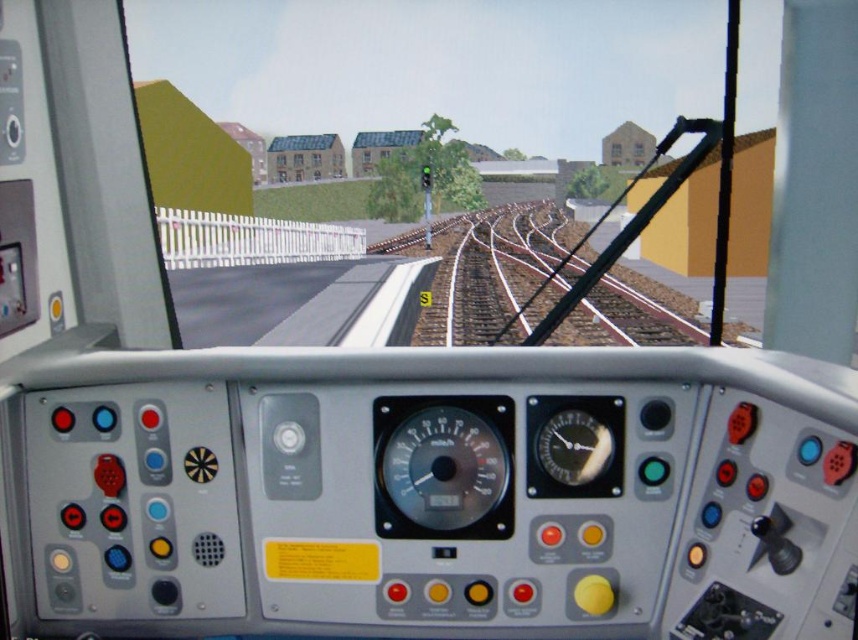
Question: Which object is positioned closest to the metallic gauge at center?

Choices:
 (A) brown wooden train track at center
 (B) shiny metallic gauge at center

Answer: (B)

Question: Does metallic gauge at center appear on the left side of shiny metallic gauge at center?

Choices:
 (A) no
 (B) yes

Answer: (B)

Question: Which point is farther to the camera?

Choices:
 (A) (394, 490)
 (B) (607, 435)
 (C) (536, 284)

Answer: (C)

Question: Considering the relative positions of brown wooden train track at center and shiny metallic gauge at center in the image provided, where is brown wooden train track at center located with respect to shiny metallic gauge at center?

Choices:
 (A) left
 (B) right

Answer: (B)

Question: Does brown wooden train track at center appear over metallic gauge at center?

Choices:
 (A) yes
 (B) no

Answer: (A)

Question: Which object is positioned closest to the metallic gauge at center?

Choices:
 (A) shiny metallic gauge at center
 (B) brown wooden train track at center

Answer: (A)